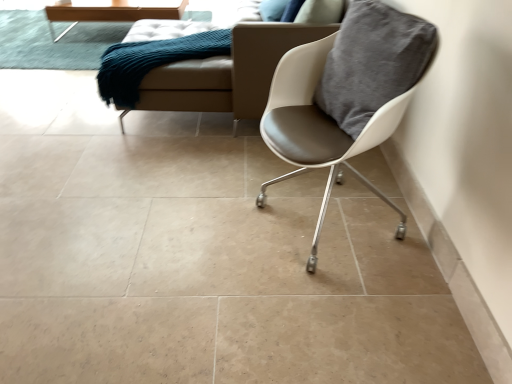
Image resolution: width=512 pixels, height=384 pixels. What are the coordinates of `white leather chair at right` in the screenshot? It's located at (345, 96).

Describe the element at coordinates (345, 96) in the screenshot. The height and width of the screenshot is (384, 512). I see `white leather chair at right` at that location.

Where is `teal fabric couch at upper left`? teal fabric couch at upper left is located at coordinates (152, 62).

The image size is (512, 384). What do you see at coordinates (237, 67) in the screenshot?
I see `beige leather couch at upper center` at bounding box center [237, 67].

Find the location of `teal knitted mat at upper left`. teal knitted mat at upper left is located at coordinates (55, 43).

Identify the location of white leather chair at right. (345, 96).

Considering the positions of objects teal knitted mat at upper left and beige leather couch at upper center in the image provided, who is more to the left, teal knitted mat at upper left or beige leather couch at upper center?

teal knitted mat at upper left.

Considering their positions, is teal knitted mat at upper left located in front of or behind beige leather couch at upper center?

teal knitted mat at upper left is positioned farther from the viewer than beige leather couch at upper center.

From the picture: How different are the orientations of teal knitted mat at upper left and beige leather couch at upper center in degrees?

The angular difference between teal knitted mat at upper left and beige leather couch at upper center is 90.7 degrees.

Looking at this image, considering the sizes of objects teal knitted mat at upper left and beige leather couch at upper center in the image provided, who is bigger, teal knitted mat at upper left or beige leather couch at upper center?

Bigger between the two is beige leather couch at upper center.

Is white leather chair at right at the left side of wooden table at upper left?

In fact, white leather chair at right is to the right of wooden table at upper left.

Is white leather chair at right turned away from wooden table at upper left?

No, wooden table at upper left is not at the back of white leather chair at right.

From the image's perspective, is white leather chair at right above or below wooden table at upper left?

Based on their image positions, white leather chair at right is located beneath wooden table at upper left.

How far apart are white leather chair at right and wooden table at upper left?

white leather chair at right and wooden table at upper left are 8.66 feet apart.

Based on the photo, how many degrees apart are the facing directions of teal knitted mat at upper left and teal fabric couch at upper left?

The angular difference between teal knitted mat at upper left and teal fabric couch at upper left is 60.6 degrees.

Considering their positions, is teal knitted mat at upper left located in front of or behind teal fabric couch at upper left?

Clearly, teal knitted mat at upper left is behind teal fabric couch at upper left.

From the image's perspective, between teal knitted mat at upper left and teal fabric couch at upper left, which one is located above?

teal knitted mat at upper left is shown above in the image.

Is teal knitted mat at upper left not inside teal fabric couch at upper left?

Indeed, teal knitted mat at upper left is completely outside teal fabric couch at upper left.

Based on the photo, can you tell me how much beige leather couch at upper center and wooden table at upper left differ in facing direction?

The facing directions of beige leather couch at upper center and wooden table at upper left are 90.9 degrees apart.

Is beige leather couch at upper center next to wooden table at upper left?

beige leather couch at upper center and wooden table at upper left are not in contact.

From the image's perspective, which object appears higher, beige leather couch at upper center or wooden table at upper left?

wooden table at upper left, from the image's perspective.

Does beige leather couch at upper center come behind wooden table at upper left?

No, the depth of beige leather couch at upper center is less than that of wooden table at upper left.

Is point (60, 10) less distant than point (193, 43)?

No, (60, 10) is further to viewer.

Based on the photo, is wooden table at upper left not near teal fabric couch at upper left?

Yes.

Can you confirm if wooden table at upper left is shorter than teal fabric couch at upper left?

Yes.

Is wooden table at upper left aimed at teal fabric couch at upper left?

Yes.

How far apart are beige leather couch at upper center and teal knitted mat at upper left?

beige leather couch at upper center and teal knitted mat at upper left are 5.94 feet apart.

How different are the orientations of beige leather couch at upper center and teal knitted mat at upper left in degrees?

beige leather couch at upper center and teal knitted mat at upper left are facing 90.7 degrees away from each other.

Considering the sizes of objects beige leather couch at upper center and teal knitted mat at upper left in the image provided, who is wider, beige leather couch at upper center or teal knitted mat at upper left?

With larger width is teal knitted mat at upper left.

Is beige leather couch at upper center positioned beyond the bounds of teal knitted mat at upper left?

Absolutely, beige leather couch at upper center is external to teal knitted mat at upper left.

Find the location of a particular element. The height and width of the screenshot is (384, 512). table behind the teal knitted mat at upper left is located at coordinates (108, 13).

Is teal knitted mat at upper left completely or partially inside wooden table at upper left?

No.

Are wooden table at upper left and teal knitted mat at upper left far apart?

No, wooden table at upper left is in close proximity to teal knitted mat at upper left.

In the image, there is a beige leather couch at upper center. Where is `mat below it (from the image's perspective)`? The height and width of the screenshot is (384, 512). mat below it (from the image's perspective) is located at coordinates (55, 43).

Find the location of a particular element. The height and width of the screenshot is (384, 512). chair on the right side of wooden table at upper left is located at coordinates (345, 96).

Which object lies nearer to the anchor point teal knitted mat at upper left, wooden table at upper left or white leather chair at right?

wooden table at upper left lies closer to teal knitted mat at upper left than the other object.

Estimate the real-world distances between objects in this image. Which object is closer to white leather chair at right, wooden table at upper left or beige leather couch at upper center?

Among the two, beige leather couch at upper center is located nearer to white leather chair at right.

From the picture: Which object lies further to the anchor point white leather chair at right, beige leather couch at upper center or teal fabric couch at upper left?

The object further to white leather chair at right is teal fabric couch at upper left.

Estimate the real-world distances between objects in this image. Which object is closer to wooden table at upper left, teal knitted mat at upper left or teal fabric couch at upper left?

The object closer to wooden table at upper left is teal knitted mat at upper left.

From the image, which object appears to be farther from white leather chair at right, beige leather couch at upper center or wooden table at upper left?

Based on the image, wooden table at upper left appears to be further to white leather chair at right.

Based on their spatial positions, is wooden table at upper left or teal knitted mat at upper left closer to beige leather couch at upper center?

The object closer to beige leather couch at upper center is wooden table at upper left.

From the image, which object appears to be farther from beige leather couch at upper center, teal fabric couch at upper left or white leather chair at right?

white leather chair at right is positioned further to the anchor beige leather couch at upper center.

When comparing their distances from teal fabric couch at upper left, does white leather chair at right or beige leather couch at upper center seem further?

Among the two, white leather chair at right is located further to teal fabric couch at upper left.

Find the location of a particular element. The image size is (512, 384). material situated between teal knitted mat at upper left and beige leather couch at upper center from left to right is located at coordinates (152, 62).

Where is `material positioned between white leather chair at right and wooden table at upper left from near to far`? material positioned between white leather chair at right and wooden table at upper left from near to far is located at coordinates (152, 62).

You are a GUI agent. You are given a task and a screenshot of the screen. Output one action in this format:
    pyautogui.click(x=<x>, y=<y>)
    Task: Click on the mat between teal fabric couch at upper left and wooden table at upper left along the z-axis
    The width and height of the screenshot is (512, 384).
    Given the screenshot: What is the action you would take?
    pyautogui.click(x=55, y=43)

Locate an element on the screen. Image resolution: width=512 pixels, height=384 pixels. material between white leather chair at right and teal knitted mat at upper left in the front-back direction is located at coordinates pyautogui.click(x=152, y=62).